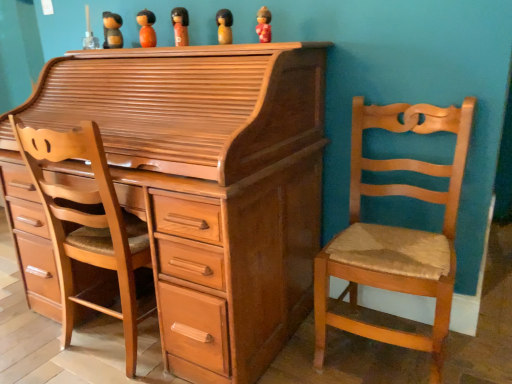
Question: Can you confirm if light brown wood swivel chair at left is taller than matte orange doll at center, the 3th toy from the left?

Choices:
 (A) yes
 (B) no

Answer: (A)

Question: Is light brown wood swivel chair at left outside of matte orange doll at center, placed as the third toy when sorted from right to left?

Choices:
 (A) yes
 (B) no

Answer: (A)

Question: From a real-world perspective, does light brown wood swivel chair at left stand above matte orange doll at center, placed as the third toy when sorted from right to left?

Choices:
 (A) yes
 (B) no

Answer: (B)

Question: Considering the relative sizes of light brown wood swivel chair at left and matte orange doll at center, the 3th toy from the left, in the image provided, is light brown wood swivel chair at left smaller than matte orange doll at center, the 3th toy from the left,?

Choices:
 (A) yes
 (B) no

Answer: (B)

Question: Considering the relative sizes of light brown wood swivel chair at left and matte orange doll at center, the 3th toy from the left, in the image provided, is light brown wood swivel chair at left wider than matte orange doll at center, the 3th toy from the left,?

Choices:
 (A) no
 (B) yes

Answer: (B)

Question: Is light brown wood swivel chair at left inside the boundaries of wooden figurine at upper center, the 5th toy in the right-to-left sequence, or outside?

Choices:
 (A) inside
 (B) outside

Answer: (B)

Question: Would you say light brown wood swivel chair at left is to the left or to the right of wooden figurine at upper center, the 5th toy in the right-to-left sequence, in the picture?

Choices:
 (A) right
 (B) left

Answer: (A)

Question: Is light brown wood swivel chair at left wider or thinner than wooden figurine at upper center, the 5th toy in the right-to-left sequence?

Choices:
 (A) wide
 (B) thin

Answer: (A)

Question: Does point (143, 241) appear closer or farther from the camera than point (109, 46)?

Choices:
 (A) farther
 (B) closer

Answer: (B)

Question: In the image, is light brown wood chest of drawers at center positioned in front of or behind wooden figurine at upper center, the 2th toy when ordered from right to left?

Choices:
 (A) behind
 (B) front

Answer: (B)

Question: From a real-world perspective, is light brown wood chest of drawers at center physically located above or below wooden figurine at upper center, the 2th toy when ordered from right to left?

Choices:
 (A) below
 (B) above

Answer: (A)

Question: Based on their positions, is light brown wood chest of drawers at center located to the left or right of wooden figurine at upper center, arranged as the fourth toy when viewed from the left?

Choices:
 (A) right
 (B) left

Answer: (B)

Question: Is point (50, 258) positioned closer to the camera than point (220, 36)?

Choices:
 (A) farther
 (B) closer

Answer: (A)

Question: In terms of width, does matte orange doll at center, the 3th toy from the left, look wider or thinner when compared to wooden figurine at upper center, which is the 1th toy in left-to-right order?

Choices:
 (A) wide
 (B) thin

Answer: (B)

Question: Is point (186, 29) positioned closer to the camera than point (117, 31)?

Choices:
 (A) farther
 (B) closer

Answer: (B)